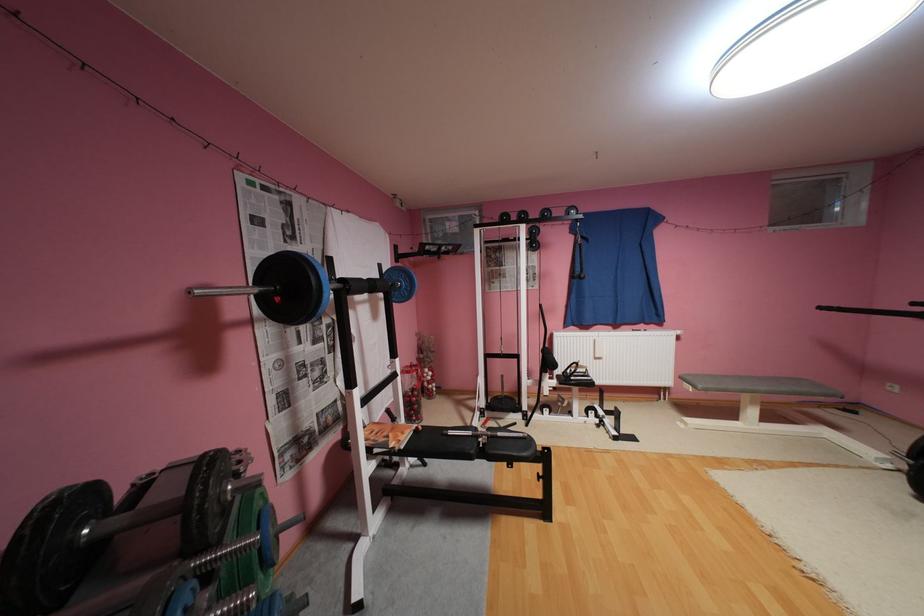
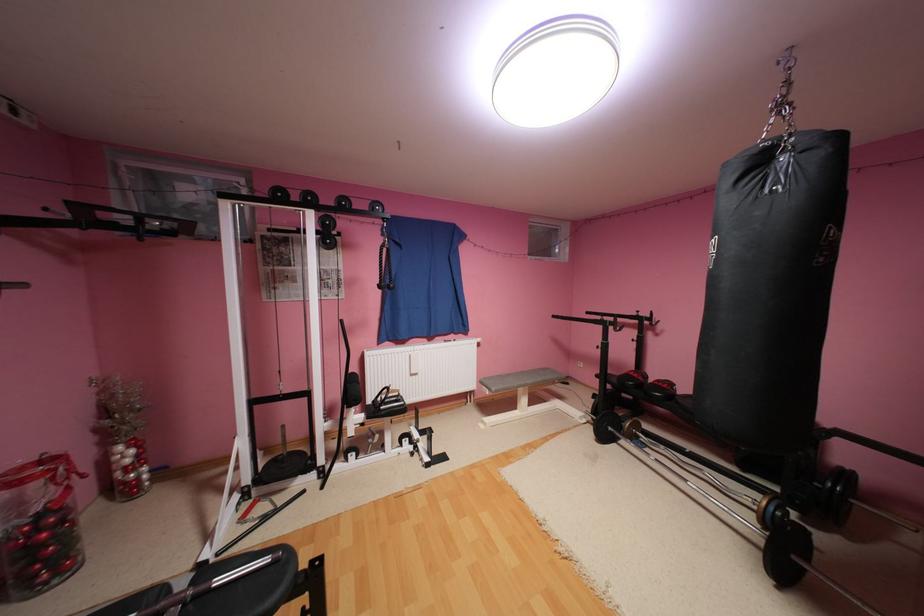
In the second image, find the point that corresponds to (771,387) in the first image.

(538, 382)